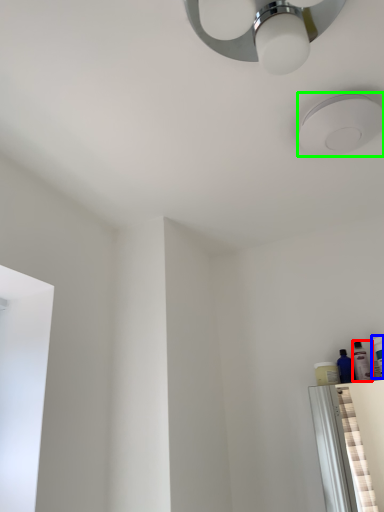
Question: Which is farther away from toiletry (highlighted by a red box)? toiletry (highlighted by a blue box) or droplight (highlighted by a green box)?

Choices:
 (A) toiletry
 (B) droplight

Answer: (B)